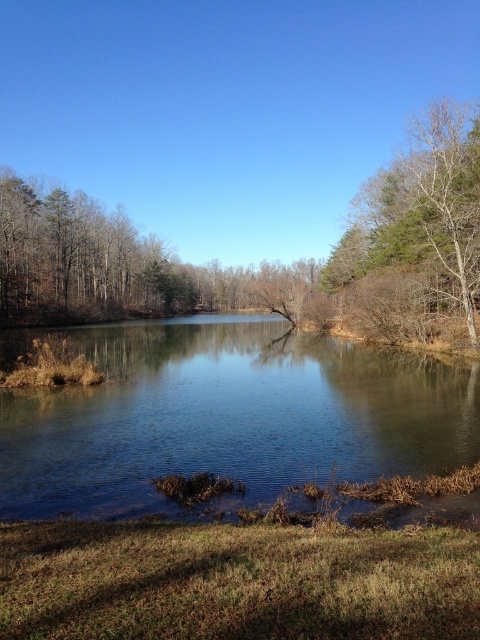
Who is shorter, clear water at center or bare branches at right?

With less height is clear water at center.

Is clear water at center taller than bare branches at right?

Incorrect, clear water at center's height is not larger of bare branches at right's.

Is point (396, 461) behind point (388, 260)?

No, it is not.

Where is `clear water at center`? This screenshot has height=640, width=480. clear water at center is located at coordinates (228, 417).